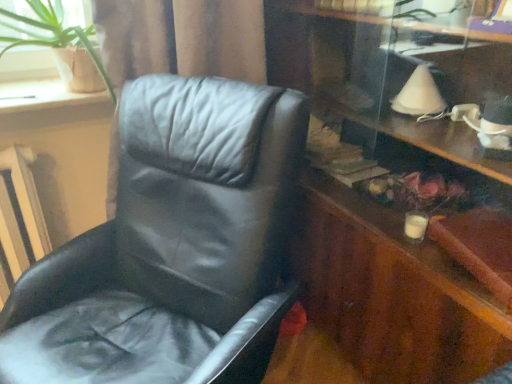
Measure the distance between point (24, 161) and camera.

They are 1.31 meters apart.

Image resolution: width=512 pixels, height=384 pixels. What do you see at coordinates (170, 246) in the screenshot?
I see `black leather chair at left` at bounding box center [170, 246].

What are the coordinates of `black leather chair at left` in the screenshot? It's located at (170, 246).

Describe the element at coordinates (42, 95) in the screenshot. I see `wooden at left` at that location.

The image size is (512, 384). Identify the location of wooden dresser at right. (401, 195).

Is wooden dresser at right taller than green leafy plant at upper left?

Indeed, wooden dresser at right has a greater height compared to green leafy plant at upper left.

Which is in front, point (474, 224) or point (99, 85)?

The point (474, 224) is closer to the camera.

Is wooden dresser at right wider or thinner than green leafy plant at upper left?

Clearly, wooden dresser at right has less width compared to green leafy plant at upper left.

From the image's perspective, which object appears higher, wooden dresser at right or green leafy plant at upper left?

green leafy plant at upper left is shown above in the image.

Consider the image. Is green leafy plant at upper left wider than wooden dresser at right?

Yes, green leafy plant at upper left is wider than wooden dresser at right.

Is green leafy plant at upper left not close to wooden dresser at right?

They are positioned close to each other.

Would you say wooden dresser at right is part of green leafy plant at upper left's contents?

No, wooden dresser at right is not surrounded by green leafy plant at upper left.

Is point (10, 28) closer or farther from the camera than point (312, 1)?

Point (10, 28) appears to be closer to the viewer than point (312, 1).

Is wooden at left placed right next to black leather chair at left?

No, wooden at left is not next to black leather chair at left.

How many degrees apart are the facing directions of wooden at left and black leather chair at left?

The angular difference between wooden at left and black leather chair at left is 65.3 degrees.

From the image's perspective, which is below, wooden at left or black leather chair at left?

From the image's view, black leather chair at left is below.

From a real-world perspective, is wooden at left physically above black leather chair at left?

Yes, from a real-world perspective, wooden at left is above black leather chair at left.

Which of these two, black leather chair at left or white textured radiator at left, is bigger?

With larger size is black leather chair at left.

Is point (242, 268) less distant than point (7, 156)?

That is True.

In the scene shown: In the image, is black leather chair at left on the left side or the right side of white textured radiator at left?

black leather chair at left is to the right of white textured radiator at left.

Considering their positions, is black leather chair at left located in front of or behind green leafy plant at upper left?

Visually, black leather chair at left is located in front of green leafy plant at upper left.

Which object is thinner, black leather chair at left or green leafy plant at upper left?

Thinner between the two is green leafy plant at upper left.

From the image's perspective, is black leather chair at left on green leafy plant at upper left?

Actually, black leather chair at left appears below green leafy plant at upper left in the image.

Considering the sizes of objects white textured radiator at left and wooden at left in the image provided, who is taller, white textured radiator at left or wooden at left?

Standing taller between the two is white textured radiator at left.

In the scene shown: Is white textured radiator at left turned away from wooden at left?

No, white textured radiator at left is not facing the opposite direction of wooden at left.

Does white textured radiator at left touch wooden at left?

There is a gap between white textured radiator at left and wooden at left.

From a real-world perspective, is black leather chair at left positioned over wooden at left based on gravity?

No, from a real-world perspective, black leather chair at left is not above wooden at left.

Who is taller, black leather chair at left or wooden at left?

black leather chair at left.

From the image's perspective, would you say black leather chair at left is positioned over wooden at left?

No, from the image's perspective, black leather chair at left is not on top of wooden at left.

Can you see black leather chair at left touching wooden at left?

black leather chair at left is not next to wooden at left, and they're not touching.

At what (x,y) coordinates should I click in order to perform the action: click on houseplant behind the wooden dresser at right. Please return your answer as a coordinate pair (x, y). Looking at the image, I should click on (58, 41).

Where is `houseplant to the left of wooden dresser at right`? houseplant to the left of wooden dresser at right is located at coordinates (58, 41).

Which object lies further to the anchor point black leather chair at left, green leafy plant at upper left or wooden at left?

The object further to black leather chair at left is wooden at left.

From the image, which object appears to be nearer to white textured radiator at left, wooden at left or wooden dresser at right?

The object closer to white textured radiator at left is wooden at left.

When comparing their distances from green leafy plant at upper left, does black leather chair at left or wooden at left seem further?

black leather chair at left is further to green leafy plant at upper left.

Looking at the image, which one is located further to green leafy plant at upper left, white textured radiator at left or wooden dresser at right?

Among the two, wooden dresser at right is located further to green leafy plant at upper left.

Estimate the real-world distances between objects in this image. Which object is closer to green leafy plant at upper left, wooden at left or black leather chair at left?

wooden at left lies closer to green leafy plant at upper left than the other object.

Which object lies nearer to the anchor point black leather chair at left, white textured radiator at left or wooden at left?

white textured radiator at left is positioned closer to the anchor black leather chair at left.

Considering their positions, is green leafy plant at upper left positioned closer to white textured radiator at left than black leather chair at left?

green leafy plant at upper left lies closer to white textured radiator at left than the other object.

Which object lies nearer to the anchor point black leather chair at left, wooden dresser at right or white textured radiator at left?

wooden dresser at right.

The width and height of the screenshot is (512, 384). What are the coordinates of `houseplant positioned between black leather chair at left and wooden at left from near to far` in the screenshot? It's located at (58, 41).

You are a GUI agent. You are given a task and a screenshot of the screen. Output one action in this format:
    pyautogui.click(x=<x>, y=<y>)
    Task: Click on the window sill located between white textured radiator at left and wooden dresser at right in the left-right direction
    This screenshot has width=512, height=384.
    Given the screenshot: What is the action you would take?
    pyautogui.click(x=42, y=95)

What are the coordinates of `radiator between black leather chair at left and wooden at left from front to back` in the screenshot? It's located at (27, 196).

Find the location of a particular element. Image resolution: width=512 pixels, height=384 pixels. houseplant between wooden at left and wooden dresser at right in the horizontal direction is located at coordinates (58, 41).